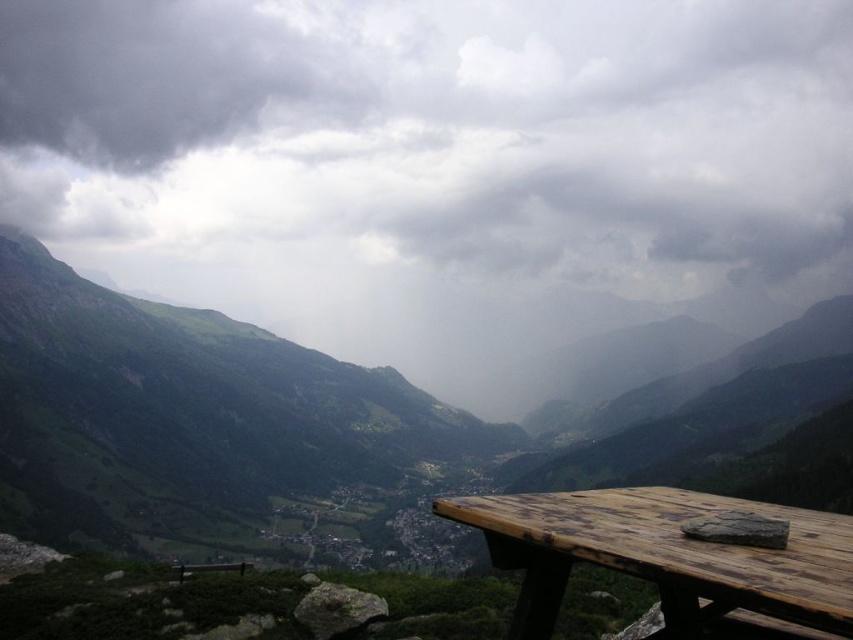
Question: Is wooden picnic table at lower right above brown wooden bench at lower center?

Choices:
 (A) no
 (B) yes

Answer: (B)

Question: Among these points, which one is nearest to the camera?

Choices:
 (A) (180, 576)
 (B) (531, 525)
 (C) (364, 552)
 (D) (395, 81)

Answer: (B)

Question: Is cloudy sky at upper center wider than wooden picnic table at lower right?

Choices:
 (A) yes
 (B) no

Answer: (A)

Question: Which point is farther from the camera taking this photo?

Choices:
 (A) click(x=711, y=570)
 (B) click(x=712, y=436)
 (C) click(x=357, y=164)

Answer: (C)

Question: Among these objects, which one is farthest from the camera?

Choices:
 (A) cloudy sky at upper center
 (B) wooden table at lower right
 (C) wooden picnic table at lower right
 (D) brown wooden bench at lower center

Answer: (A)

Question: Is wooden picnic table at lower right wider than brown wooden bench at lower center?

Choices:
 (A) yes
 (B) no

Answer: (B)